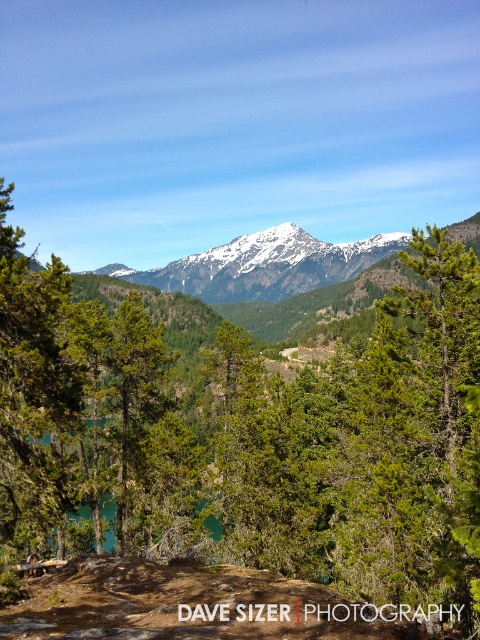
Can you confirm if white snow-covered mountain range at center is positioned above teal glass lake at center?

Indeed, white snow-covered mountain range at center is positioned over teal glass lake at center.

Between white snow-covered mountain range at center and teal glass lake at center, which one has less height?

teal glass lake at center is shorter.

The image size is (480, 640). Identify the location of white snow-covered mountain range at center. (264, 266).

Where is `white snow-covered mountain range at center`? The height and width of the screenshot is (640, 480). white snow-covered mountain range at center is located at coordinates (264, 266).

Which is more to the right, green leafy tree at center or white snow-covered mountain range at center?

white snow-covered mountain range at center

Is point (436, 269) closer to viewer compared to point (120, 269)?

Yes, it is.

Find the location of a particular element. green leafy tree at center is located at coordinates (247, 436).

From the picture: Who is higher up, green matte tree at left or teal glass lake at center?

green matte tree at left is higher up.

Can you confirm if green matte tree at left is positioned above teal glass lake at center?

Yes, green matte tree at left is above teal glass lake at center.

Locate an element on the screen. green matte tree at left is located at coordinates (37, 397).

The width and height of the screenshot is (480, 640). I want to click on green matte tree at left, so click(37, 397).